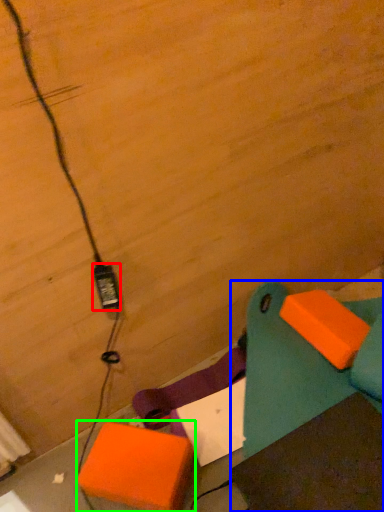
Question: Which object is positioned farthest from power plugs and sockets (highlighted by a red box)? Select from furniture (highlighted by a blue box) and cardboard box (highlighted by a green box).

Choices:
 (A) furniture
 (B) cardboard box

Answer: (A)